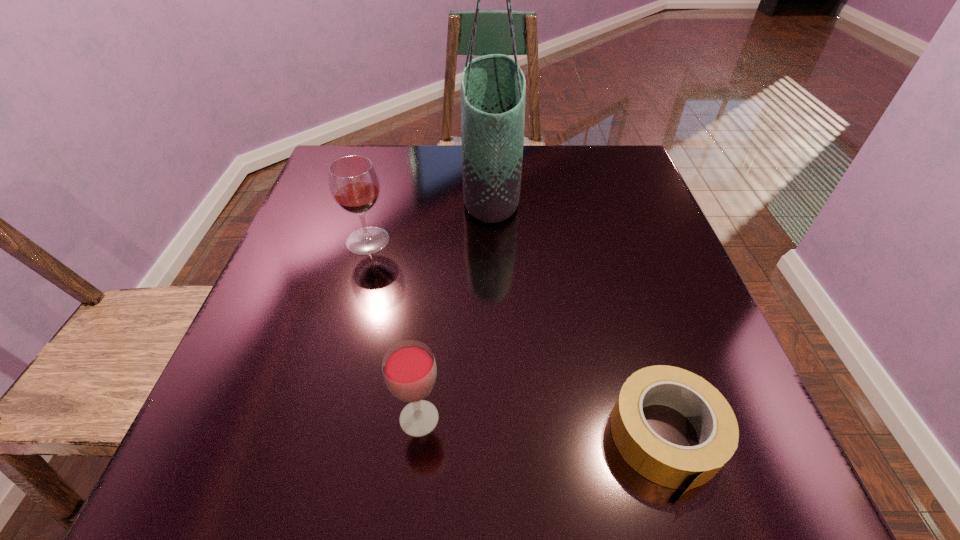
Locate an element on the screen. The width and height of the screenshot is (960, 540). free space between the tallest object and the rightmost object is located at coordinates (579, 312).

The height and width of the screenshot is (540, 960). Find the location of `free space between the nearer wineglass and the third object from left to right`. free space between the nearer wineglass and the third object from left to right is located at coordinates (455, 302).

You are a GUI agent. You are given a task and a screenshot of the screen. Output one action in this format:
    pyautogui.click(x=<x>, y=<y>)
    Task: Click on the object that stands as the third closest to the third nearest object
    The width and height of the screenshot is (960, 540).
    Given the screenshot: What is the action you would take?
    pyautogui.click(x=677, y=467)

Identify which object is located as the nearest to the farther wineglass. Please provide its 2D coordinates. Your answer should be formatted as a tuple, i.e. [(x, y)], where the tuple contains the x and y coordinates of a point satisfying the conditions above.

[(493, 88)]

Locate an element on the screen. The height and width of the screenshot is (540, 960). free space that satisfies the following two spatial constraints: 1. on the back side of the right wineglass; 2. on the right side of the tallest object is located at coordinates (444, 185).